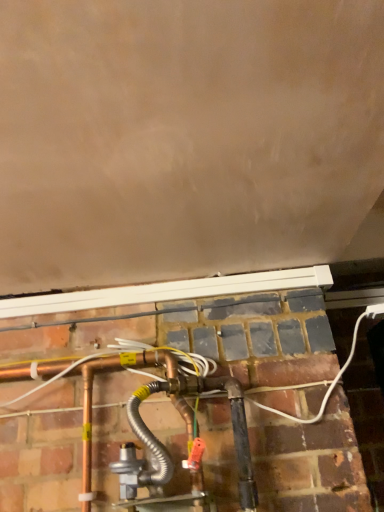
Describe the element at coordinates (188, 442) in the screenshot. I see `silver metallic hose at center` at that location.

Find the location of a particular element. This screenshot has width=384, height=512. silver metallic hose at center is located at coordinates (188, 442).

The image size is (384, 512). Find the location of `silver metallic hose at center`. silver metallic hose at center is located at coordinates (188, 442).